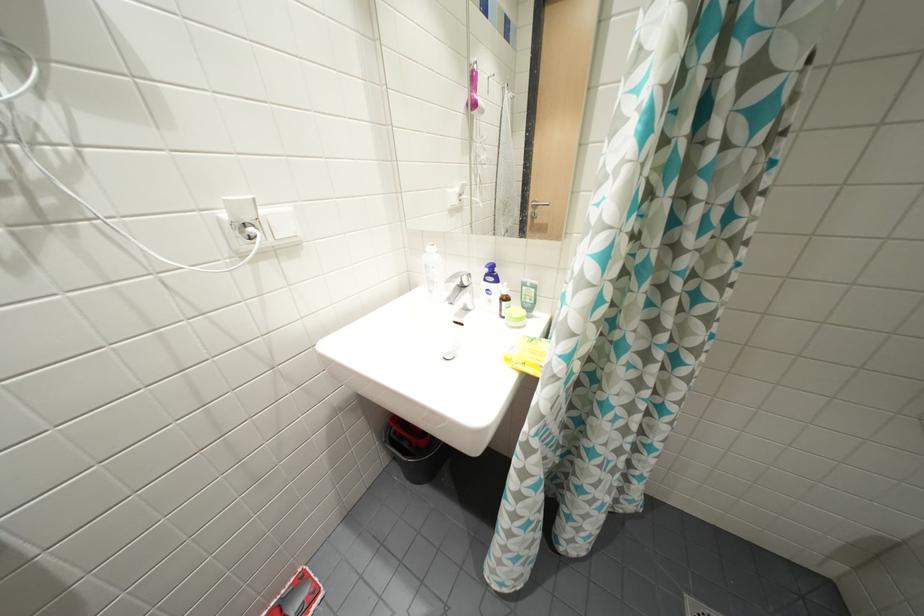
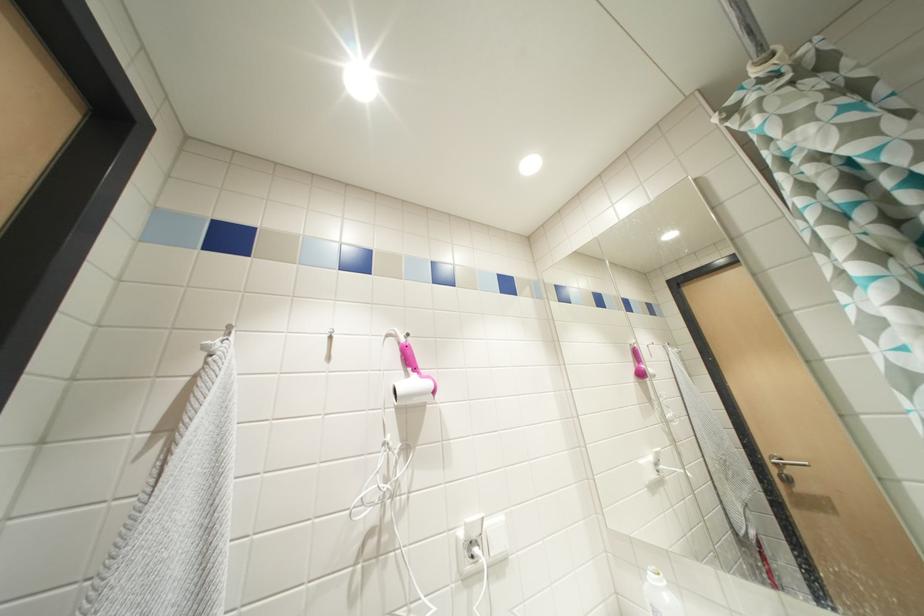
First-person continuous shooting, in which direction is the camera rotating?

The rotation direction of the camera is left-up.